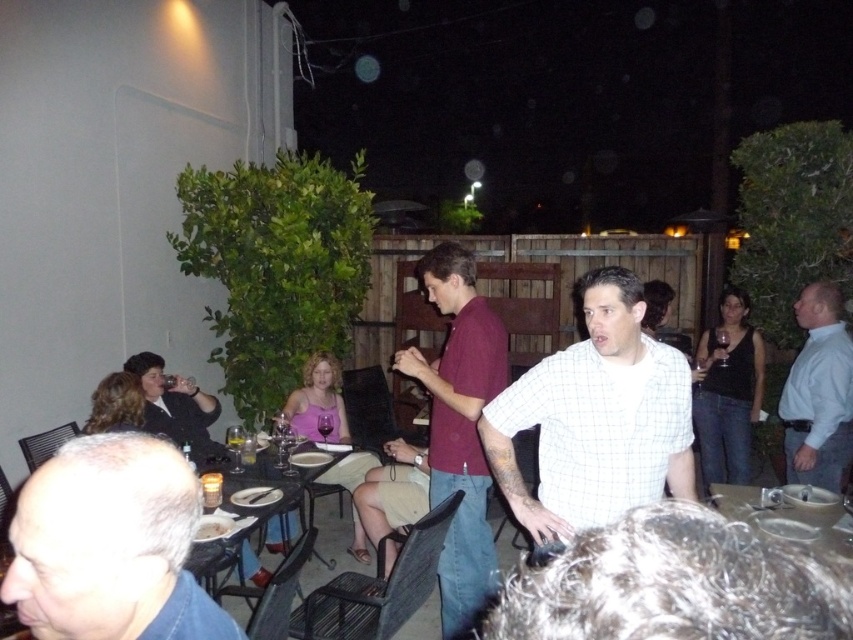
Consider the image. Is white checkered shirt at center to the left of maroon shirt at center from the viewer's perspective?

No, white checkered shirt at center is not to the left of maroon shirt at center.

Which is behind, point (654, 467) or point (436, 396)?

The point (436, 396) is more distant.

Is point (556, 396) more distant than point (428, 474)?

That is False.

At what (x,y) coordinates should I click in order to perform the action: click on white checkered shirt at center. Please return your answer as a coordinate pair (x, y). The width and height of the screenshot is (853, 640). Looking at the image, I should click on (596, 419).

Is gray hair at lower left in front of maroon shirt at center?

Yes.

Measure the distance from gray hair at lower left to maroon shirt at center.

gray hair at lower left is 2.04 meters away from maroon shirt at center.

Does point (164, 552) come in front of point (447, 417)?

That is True.

This screenshot has width=853, height=640. Identify the location of gray hair at lower left. (109, 545).

Is point (618, 410) more distant than point (172, 419)?

No, (618, 410) is in front of (172, 419).

Is white checkered shirt at center in front of matte black shirt at center?

Yes, white checkered shirt at center is in front of matte black shirt at center.

In order to click on white checkered shirt at center in this screenshot , I will do `click(596, 419)`.